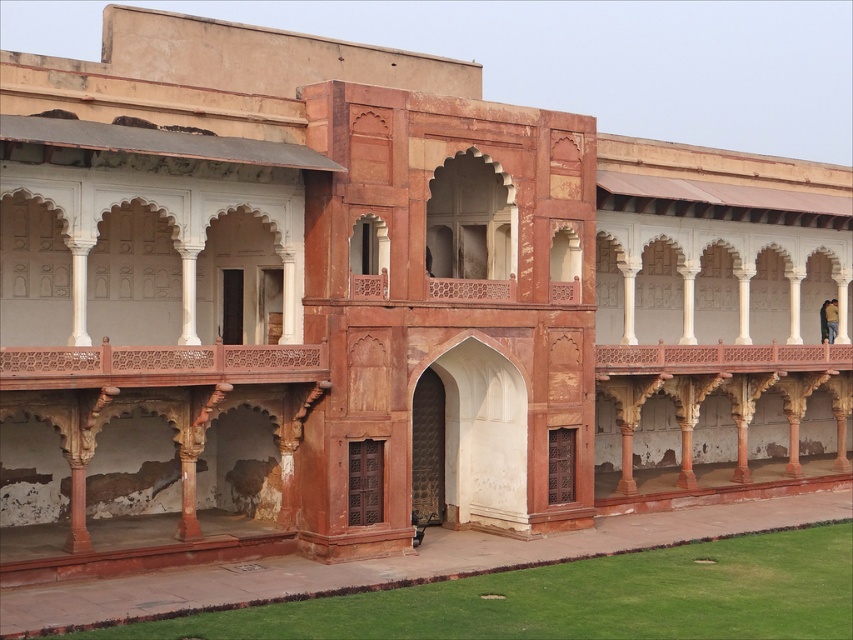
Based on the photo, does carved wood balcony at center appear over rustic wood balcony at upper center?

Incorrect, carved wood balcony at center is not positioned above rustic wood balcony at upper center.

Between point (56, 353) and point (662, 349), which one is positioned behind?

The point (662, 349) is more distant.

Describe the element at coordinates (160, 365) in the screenshot. I see `carved wood balcony at center` at that location.

Where is `carved wood balcony at center`? carved wood balcony at center is located at coordinates (160, 365).